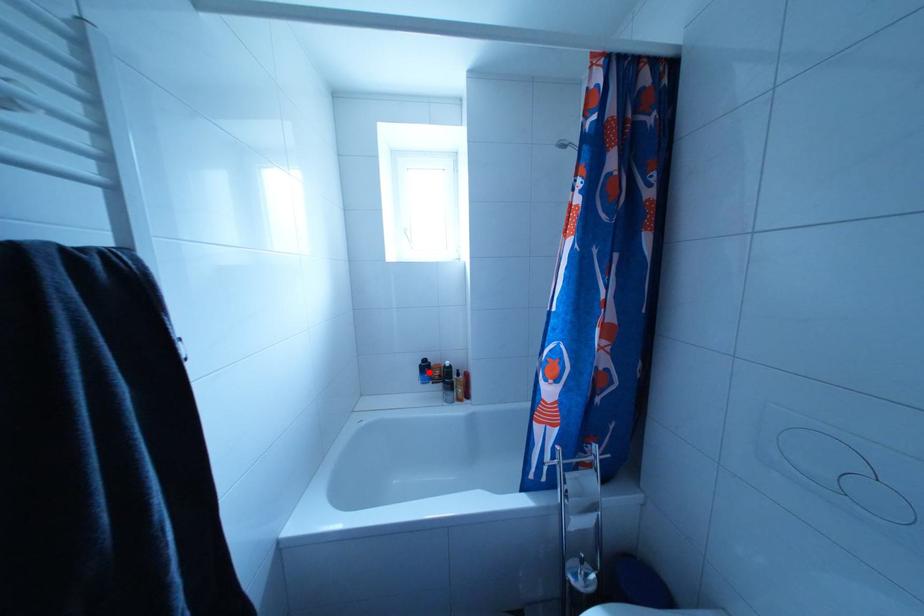
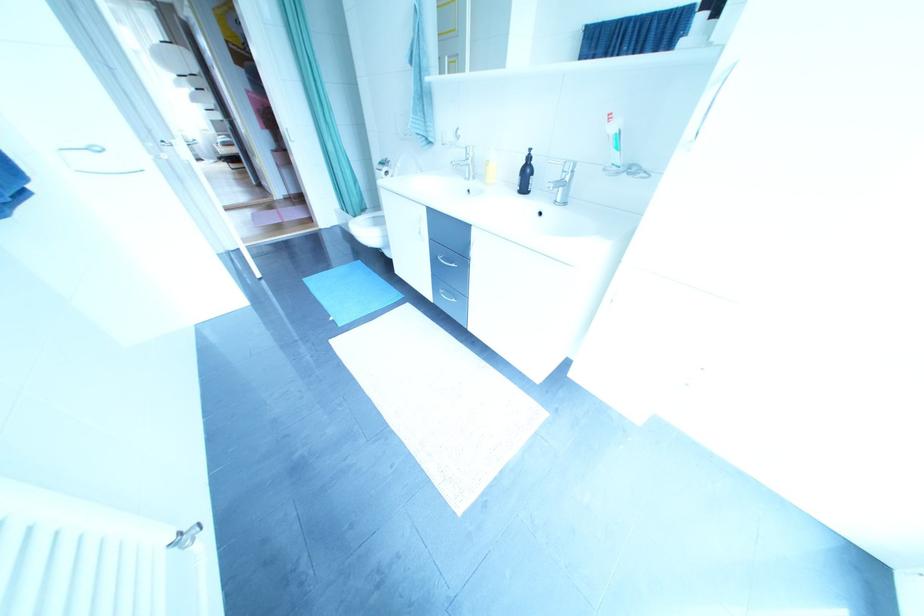
Question: I am providing you with two images of the same scene from different viewpoints. A red point is marked on the first image. At the location where the point appears in image 1, is it still visible in image 2?

Choices:
 (A) Yes
 (B) No

Answer: (B)